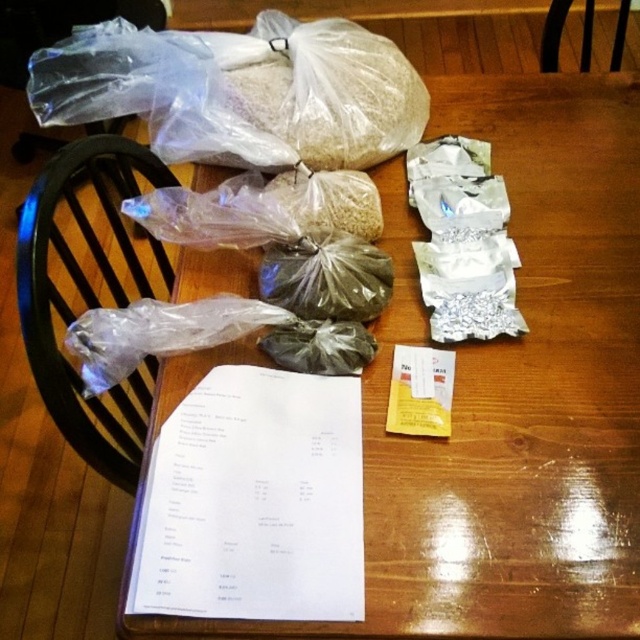
Question: Considering the real-world distances, which object is closest to the white paper at center?

Choices:
 (A) yellow paper at center
 (B) black wood chair at upper right
 (C) clear plastic bag at upper center

Answer: (A)

Question: Which object is farther from the camera taking this photo?

Choices:
 (A) black wood chair at upper right
 (B) wooden table at center
 (C) yellow paper at center
 (D) white paper at center

Answer: (A)

Question: Does black wood chair at left appear on the left side of transparent plastic bag at lower left?

Choices:
 (A) yes
 (B) no

Answer: (A)

Question: Which point is farther to the camera?

Choices:
 (A) (97, 205)
 (B) (140, 570)
 (C) (99, 356)

Answer: (A)

Question: Where is wooden table at center located in relation to black wood chair at left in the image?

Choices:
 (A) above
 (B) below

Answer: (A)

Question: Does wooden table at center appear under clear plastic bag at upper center?

Choices:
 (A) no
 (B) yes

Answer: (B)